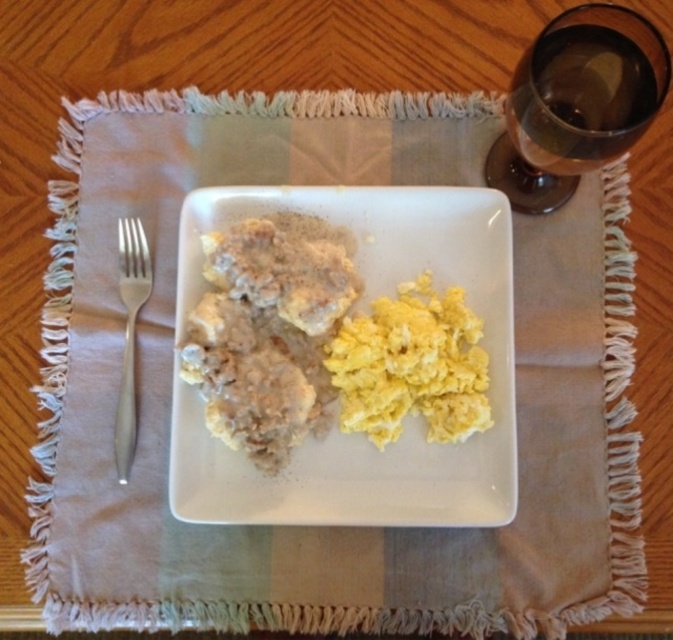
Question: Which object appears farthest from the camera in this image?

Choices:
 (A) white matte plate at center
 (B) silver metallic fork at left
 (C) yellow scrambled eggs at center
 (D) transparent glass at upper right

Answer: (B)

Question: Which point appears farthest from the camera in this image?

Choices:
 (A) (660, 88)
 (B) (470, 508)
 (C) (131, 349)

Answer: (C)

Question: Does transparent glass at upper right appear over silver metallic fork at left?

Choices:
 (A) no
 (B) yes

Answer: (B)

Question: Does white matte plate at center appear under transparent glass at upper right?

Choices:
 (A) yes
 (B) no

Answer: (A)

Question: Which object is positioned farthest from the transparent glass at upper right?

Choices:
 (A) yellow scrambled eggs at center
 (B) silver metallic fork at left

Answer: (B)

Question: Is white matte plate at center above silver metallic fork at left?

Choices:
 (A) no
 (B) yes

Answer: (A)